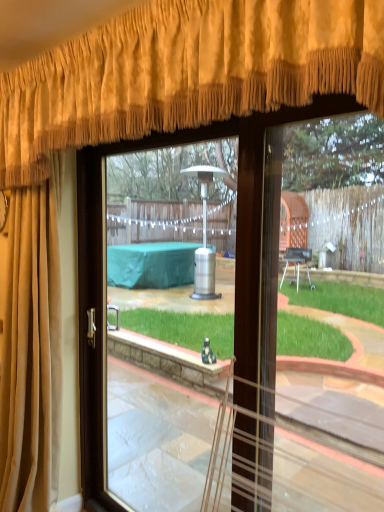
Question: Considering the relative sizes of suede-like beige curtain at upper left, the second curtain when ordered from top to bottom, and clear glass door at center in the image provided, is suede-like beige curtain at upper left, the second curtain when ordered from top to bottom, taller than clear glass door at center?

Choices:
 (A) yes
 (B) no

Answer: (A)

Question: Is clear glass door at center at the back of suede-like beige curtain at upper left, the second curtain when ordered from top to bottom?

Choices:
 (A) yes
 (B) no

Answer: (B)

Question: Is suede-like beige curtain at upper left, the second curtain when ordered from top to bottom, to the left of clear glass door at center from the viewer's perspective?

Choices:
 (A) yes
 (B) no

Answer: (A)

Question: Is suede-like beige curtain at upper left, the second curtain when ordered from top to bottom, not inside clear glass door at center?

Choices:
 (A) no
 (B) yes

Answer: (B)

Question: Is suede-like beige curtain at upper left, the first curtain in the bottom-to-top sequence, oriented towards clear glass door at center?

Choices:
 (A) yes
 (B) no

Answer: (B)

Question: From a real-world perspective, does suede-like beige curtain at upper left, the first curtain in the bottom-to-top sequence, sit lower than clear glass door at center?

Choices:
 (A) no
 (B) yes

Answer: (A)

Question: Considering the relative sizes of clear glass door at center and suede-like beige curtain at upper left, the first curtain in the bottom-to-top sequence, in the image provided, is clear glass door at center taller than suede-like beige curtain at upper left, the first curtain in the bottom-to-top sequence,?

Choices:
 (A) yes
 (B) no

Answer: (B)

Question: Does clear glass door at center have a smaller size compared to suede-like beige curtain at upper left, the first curtain in the bottom-to-top sequence?

Choices:
 (A) yes
 (B) no

Answer: (A)

Question: Can you confirm if clear glass door at center is thinner than suede-like beige curtain at upper left, the first curtain in the bottom-to-top sequence?

Choices:
 (A) no
 (B) yes

Answer: (B)

Question: From the image's perspective, is clear glass door at center located beneath suede-like beige curtain at upper left, the first curtain in the bottom-to-top sequence?

Choices:
 (A) yes
 (B) no

Answer: (A)

Question: Is clear glass door at center positioned in front of suede-like beige curtain at upper left, the second curtain when ordered from top to bottom?

Choices:
 (A) no
 (B) yes

Answer: (B)

Question: Is clear glass door at center outside of suede-like beige curtain at upper left, the second curtain when ordered from top to bottom?

Choices:
 (A) no
 (B) yes

Answer: (B)

Question: Does suede-like beige curtain at upper left, the first curtain in the bottom-to-top sequence, have a lesser height compared to gold velvet curtain at upper center, the second curtain positioned from the bottom?

Choices:
 (A) no
 (B) yes

Answer: (A)